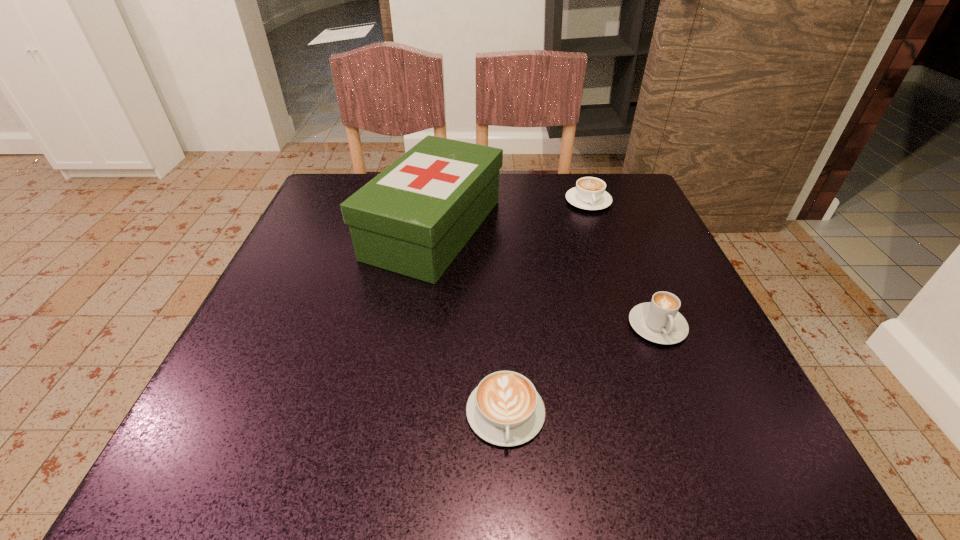
Find the location of a particular element. the tallest object is located at coordinates click(413, 218).

This screenshot has width=960, height=540. Identify the location of the third farthest object. (659, 321).

Where is `the tallest cappuccino`? the tallest cappuccino is located at coordinates (659, 321).

Where is `the farthest cappuccino`? the farthest cappuccino is located at coordinates (589, 193).

Locate an element on the screen. The width and height of the screenshot is (960, 540). the leftmost cappuccino is located at coordinates (505, 409).

Identify the location of the shortest object. (505, 409).

Find the location of a particular element. The width and height of the screenshot is (960, 540). vacant position located on the right of the tallest object is located at coordinates (591, 229).

The image size is (960, 540). Identify the location of vacant point located to the right of the third farthest object. (706, 443).

At what (x,y) coordinates should I click in order to perform the action: click on free spot located 0.390m on the side of the farthest cappuccino with the handle. Please return your answer as a coordinate pair (x, y). The width and height of the screenshot is (960, 540). Looking at the image, I should click on (636, 339).

You are a GUI agent. You are given a task and a screenshot of the screen. Output one action in this format:
    pyautogui.click(x=<x>, y=<y>)
    Task: Click on the first-aid kit positioned at the far edge
    
    Given the screenshot: What is the action you would take?
    pyautogui.click(x=413, y=218)